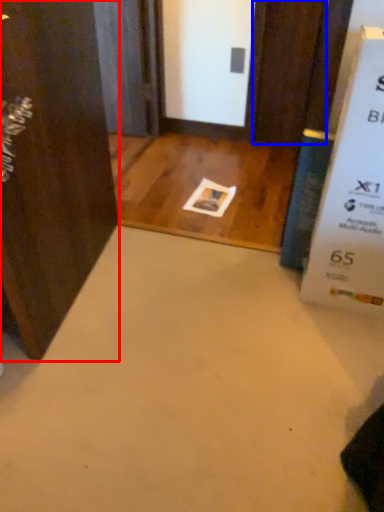
Question: Which object appears closest to the camera in this image, door (highlighted by a red box) or door (highlighted by a blue box)?

Choices:
 (A) door
 (B) door

Answer: (A)